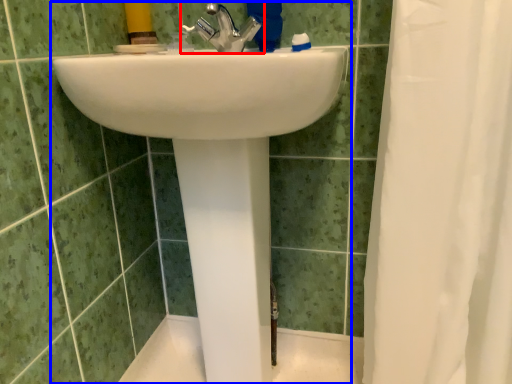
Question: Which point is further to the camera, tap (highlighted by a red box) or sink (highlighted by a blue box)?

Choices:
 (A) tap
 (B) sink

Answer: (A)